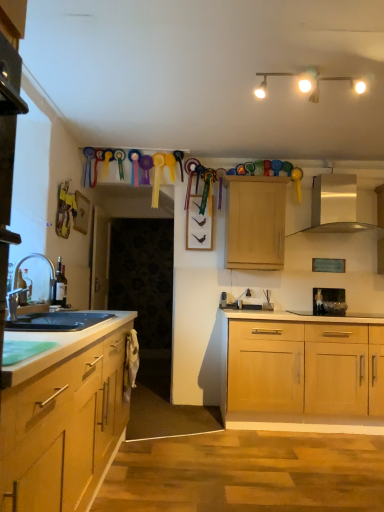
Question: Is black glass gas stove at center to the right of light wood cabinet at upper center from the viewer's perspective?

Choices:
 (A) no
 (B) yes

Answer: (B)

Question: Is the depth of black glass gas stove at center greater than that of light wood cabinet at upper center?

Choices:
 (A) yes
 (B) no

Answer: (B)

Question: Is black glass gas stove at center positioned with its back to light wood cabinet at upper center?

Choices:
 (A) yes
 (B) no

Answer: (B)

Question: Does black glass gas stove at center have a greater width compared to light wood cabinet at upper center?

Choices:
 (A) yes
 (B) no

Answer: (A)

Question: Is black glass gas stove at center bigger than light wood cabinet at upper center?

Choices:
 (A) yes
 (B) no

Answer: (B)

Question: Considering their positions, is silver metallic exhaust hood at upper center located in front of or behind white matte track lights at upper center?

Choices:
 (A) front
 (B) behind

Answer: (B)

Question: Is point (327, 205) closer or farther from the camera than point (306, 89)?

Choices:
 (A) closer
 (B) farther

Answer: (B)

Question: Considering the positions of silver metallic exhaust hood at upper center and white matte track lights at upper center in the image, is silver metallic exhaust hood at upper center wider or thinner than white matte track lights at upper center?

Choices:
 (A) wide
 (B) thin

Answer: (B)

Question: From a real-world perspective, is silver metallic exhaust hood at upper center physically located above or below white matte track lights at upper center?

Choices:
 (A) above
 (B) below

Answer: (B)

Question: From a real-world perspective, is light wood cabinet at upper center above or below white matte track lights at upper center?

Choices:
 (A) above
 (B) below

Answer: (B)

Question: From the image's perspective, is light wood cabinet at upper center located above or below white matte track lights at upper center?

Choices:
 (A) below
 (B) above

Answer: (A)

Question: Is point (266, 189) closer or farther from the camera than point (316, 97)?

Choices:
 (A) closer
 (B) farther

Answer: (B)

Question: In the image, is light wood cabinet at upper center positioned in front of or behind white matte track lights at upper center?

Choices:
 (A) behind
 (B) front

Answer: (A)

Question: Do you think black granite countertop at lower left is within silver metallic faucet at left, or outside of it?

Choices:
 (A) inside
 (B) outside

Answer: (B)

Question: From a real-world perspective, relative to silver metallic faucet at left, is black granite countertop at lower left vertically above or below?

Choices:
 (A) below
 (B) above

Answer: (A)